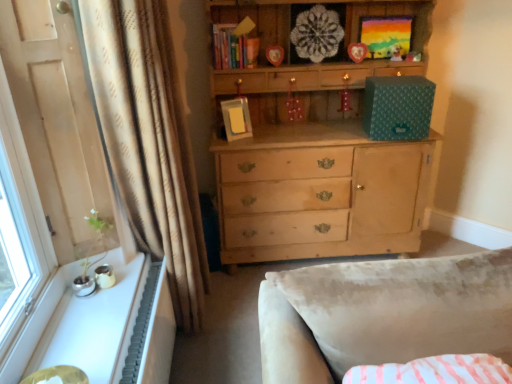
The width and height of the screenshot is (512, 384). I want to click on matte yellow book at upper center, so click(234, 45).

What do you see at coordinates (147, 140) in the screenshot?
I see `beige textured curtain at left` at bounding box center [147, 140].

Measure the distance between point (128, 363) and camera.

They are 1.49 meters apart.

This screenshot has width=512, height=384. Find the location of `white textured radiator at lower left`. white textured radiator at lower left is located at coordinates (151, 332).

This screenshot has width=512, height=384. Identify the location of plush yellow teddy bear at upper center. (396, 52).

You are a GUI agent. You are given a task and a screenshot of the screen. Output one action in this format:
    pyautogui.click(x=<x>, y=<y>)
    Task: Click on the matte yellow book at upper center
    The width and height of the screenshot is (512, 384).
    Given the screenshot: What is the action you would take?
    pyautogui.click(x=234, y=45)

Considering the relative sizes of white textured radiator at lower left and plush yellow teddy bear at upper center in the image provided, is white textured radiator at lower left shorter than plush yellow teddy bear at upper center?

No, white textured radiator at lower left is not shorter than plush yellow teddy bear at upper center.

Which object is thinner, white textured radiator at lower left or plush yellow teddy bear at upper center?

Thinner between the two is plush yellow teddy bear at upper center.

Locate an element on the screen. This screenshot has width=512, height=384. radiator below the plush yellow teddy bear at upper center (from the image's perspective) is located at coordinates (151, 332).

In the scene shown: From a real-world perspective, which object rests below the other?

From a 3D spatial view, beige textured curtain at left is below.

From the image's perspective, is beige textured curtain at left above or below matte yellow book at upper center?

beige textured curtain at left is below matte yellow book at upper center.

Between beige textured curtain at left and matte yellow book at upper center, which one has larger width?

With larger width is beige textured curtain at left.

Based on the photo, looking at the image, does matte yellow book at upper center seem bigger or smaller compared to white glossy windowsill at lower left?

Clearly, matte yellow book at upper center is smaller in size than white glossy windowsill at lower left.

Is matte yellow book at upper center positioned with its back to white glossy windowsill at lower left?

matte yellow book at upper center does not have its back to white glossy windowsill at lower left.

Measure the distance from matte yellow book at upper center to white glossy windowsill at lower left.

matte yellow book at upper center is 4.27 feet from white glossy windowsill at lower left.

At what (x,y) coordinates should I click in order to perform the action: click on cabinetry below the matte yellow book at upper center (from a real-world perspective). Please return your answer as a coordinate pair (x, y). Image resolution: width=512 pixels, height=384 pixels. Looking at the image, I should click on (113, 327).

From the image's perspective, which object appears higher, plush yellow teddy bear at upper center or beige textured curtain at left?

plush yellow teddy bear at upper center appears higher in the image.

Locate an element on the screen. This screenshot has width=512, height=384. curtain located underneath the plush yellow teddy bear at upper center (from a real-world perspective) is located at coordinates (147, 140).

Can you tell me how much plush yellow teddy bear at upper center and beige textured curtain at left differ in facing direction?

The angular difference between plush yellow teddy bear at upper center and beige textured curtain at left is 86.2 degrees.

From the picture: Considering the relative positions of plush yellow teddy bear at upper center and beige textured curtain at left in the image provided, is plush yellow teddy bear at upper center behind beige textured curtain at left?

Yes, it is behind beige textured curtain at left.

Between white textured radiator at lower left and matte yellow book at upper center, which one has larger size?

white textured radiator at lower left is bigger.

From the image's perspective, which is below, white textured radiator at lower left or matte yellow book at upper center?

white textured radiator at lower left appears lower in the image.

From a real-world perspective, is white textured radiator at lower left located higher than matte yellow book at upper center?

No, from a real-world perspective, white textured radiator at lower left is not above matte yellow book at upper center.

Does white textured radiator at lower left have a greater height compared to matte yellow book at upper center?

Indeed, white textured radiator at lower left has a greater height compared to matte yellow book at upper center.

From a real-world perspective, is plush yellow teddy bear at upper center positioned over matte yellow book at upper center based on gravity?

No, from a real-world perspective, plush yellow teddy bear at upper center is not over matte yellow book at upper center

Which object is further away from the camera taking this photo, plush yellow teddy bear at upper center or matte yellow book at upper center?

plush yellow teddy bear at upper center is more distant.

From the image's perspective, does plush yellow teddy bear at upper center appear lower than matte yellow book at upper center?

Yes, from the image's perspective, plush yellow teddy bear at upper center is beneath matte yellow book at upper center.

Is white glossy windowsill at lower left inside the boundaries of white textured radiator at lower left, or outside?

white glossy windowsill at lower left exists outside the volume of white textured radiator at lower left.

Can you confirm if white glossy windowsill at lower left is shorter than white textured radiator at lower left?

Yes.

Is white glossy windowsill at lower left behind white textured radiator at lower left?

No, white glossy windowsill at lower left is closer to the camera.

At what (x,y) coordinates should I click in order to perform the action: click on toy above the white textured radiator at lower left (from a real-world perspective). Please return your answer as a coordinate pair (x, y). Image resolution: width=512 pixels, height=384 pixels. Looking at the image, I should click on (396, 52).

Find the location of a particular element. The width and height of the screenshot is (512, 384). curtain beneath the matte yellow book at upper center (from a real-world perspective) is located at coordinates (147, 140).

Estimate the real-world distances between objects in this image. Which object is closer to beige textured curtain at left, plush yellow teddy bear at upper center or matte yellow book at upper center?

Among the two, matte yellow book at upper center is located nearer to beige textured curtain at left.

Based on the photo, which object lies nearer to the anchor point plush yellow teddy bear at upper center, matte yellow book at upper center or beige textured curtain at left?

matte yellow book at upper center is closer to plush yellow teddy bear at upper center.

Which object lies further to the anchor point white textured radiator at lower left, white glossy windowsill at lower left or plush yellow teddy bear at upper center?

plush yellow teddy bear at upper center is further to white textured radiator at lower left.

Based on their spatial positions, is beige textured curtain at left or plush yellow teddy bear at upper center closer to white textured radiator at lower left?

beige textured curtain at left lies closer to white textured radiator at lower left than the other object.

Estimate the real-world distances between objects in this image. Which object is closer to white glossy windowsill at lower left, plush yellow teddy bear at upper center or matte yellow book at upper center?

matte yellow book at upper center is closer to white glossy windowsill at lower left.

From the picture: Looking at the image, which one is located closer to white glossy windowsill at lower left, matte yellow book at upper center or beige textured curtain at left?

The object closer to white glossy windowsill at lower left is beige textured curtain at left.

In the scene shown: Considering their positions, is plush yellow teddy bear at upper center positioned further to beige textured curtain at left than white textured radiator at lower left?

plush yellow teddy bear at upper center is further to beige textured curtain at left.

From the image, which object appears to be nearer to white textured radiator at lower left, beige textured curtain at left or matte yellow book at upper center?

beige textured curtain at left.

Locate an element on the screen. This screenshot has width=512, height=384. curtain between plush yellow teddy bear at upper center and white textured radiator at lower left vertically is located at coordinates coord(147,140).

What are the coordinates of `cabinetry between beige textured curtain at left and white textured radiator at lower left in the up-down direction` in the screenshot? It's located at (113, 327).

Where is `toy between matte yellow book at upper center and white textured radiator at lower left from top to bottom`? toy between matte yellow book at upper center and white textured radiator at lower left from top to bottom is located at coordinates (396, 52).

Locate an element on the screen. Image resolution: width=512 pixels, height=384 pixels. toy between matte yellow book at upper center and white glossy windowsill at lower left in the vertical direction is located at coordinates (396, 52).